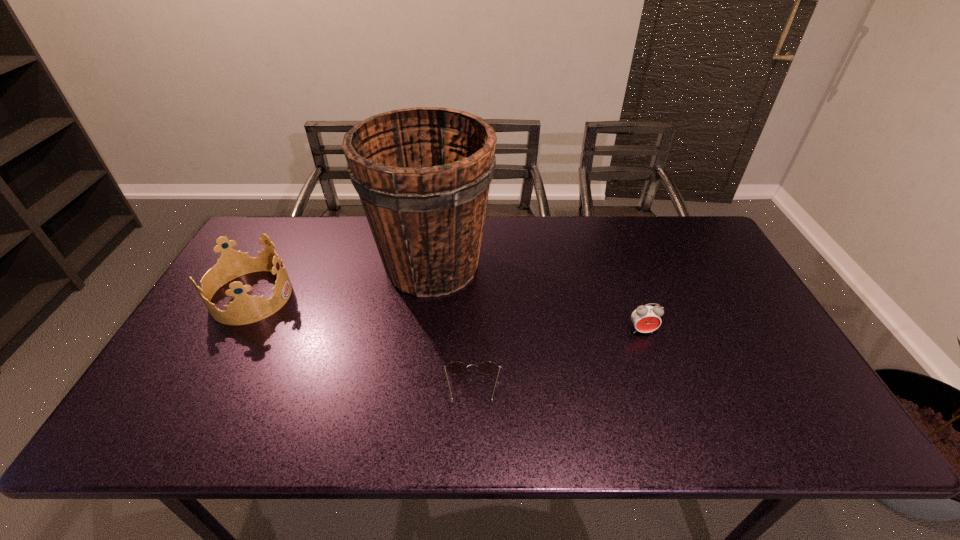
Where is `vacant space that's between the bucket and the spectacles`? vacant space that's between the bucket and the spectacles is located at coordinates (452, 328).

Where is `blank region between the rightmost object and the second tallest object`? This screenshot has height=540, width=960. blank region between the rightmost object and the second tallest object is located at coordinates (446, 314).

Locate an element on the screen. The image size is (960, 540). blank region between the second tallest object and the nearest object is located at coordinates (362, 343).

You are a GUI agent. You are given a task and a screenshot of the screen. Output one action in this format:
    pyautogui.click(x=<x>, y=<y>)
    Task: Click on the vacant area that lies between the second tallest object and the tallest object
    Image resolution: width=960 pixels, height=540 pixels.
    Given the screenshot: What is the action you would take?
    pyautogui.click(x=342, y=281)

Where is `empty space that is in between the nearest object and the bucket`? Image resolution: width=960 pixels, height=540 pixels. empty space that is in between the nearest object and the bucket is located at coordinates (452, 328).

What are the coordinates of `vacant space in between the tallest object and the rightmost object` in the screenshot? It's located at (537, 298).

You are a GUI agent. You are given a task and a screenshot of the screen. Output one action in this format:
    pyautogui.click(x=<x>, y=<y>)
    Task: Click on the free space that is in between the tallest object and the third shortest object
    The width and height of the screenshot is (960, 540).
    Given the screenshot: What is the action you would take?
    pyautogui.click(x=342, y=281)

Where is `free area in between the leftmost object and the bucket`? Image resolution: width=960 pixels, height=540 pixels. free area in between the leftmost object and the bucket is located at coordinates (342, 281).

Locate an element on the screen. free space that is in between the second tallest object and the spectacles is located at coordinates (362, 343).

I want to click on the third closest object to the bucket, so click(x=646, y=318).